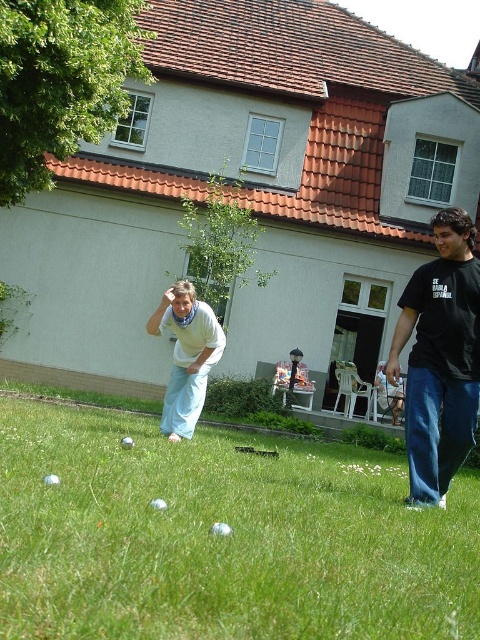
Question: Can you confirm if green grass at center is positioned to the left of black cotton t-shirt at right?

Choices:
 (A) yes
 (B) no

Answer: (A)

Question: Is green grass at center thinner than light blue fabric at center?

Choices:
 (A) no
 (B) yes

Answer: (A)

Question: Based on their relative distances, which object is farther from the light blue fabric at center?

Choices:
 (A) black cotton t-shirt at right
 (B) green grass at center

Answer: (B)

Question: Based on their relative distances, which object is nearer to the black cotton t-shirt at right?

Choices:
 (A) green grass at center
 (B) light blue fabric at center

Answer: (A)

Question: Which of the following is the closest to the observer?

Choices:
 (A) black cotton t-shirt at right
 (B) green grass at center
 (C) light blue fabric at center

Answer: (B)

Question: Does black cotton t-shirt at right appear on the left side of light blue fabric at center?

Choices:
 (A) yes
 (B) no

Answer: (B)